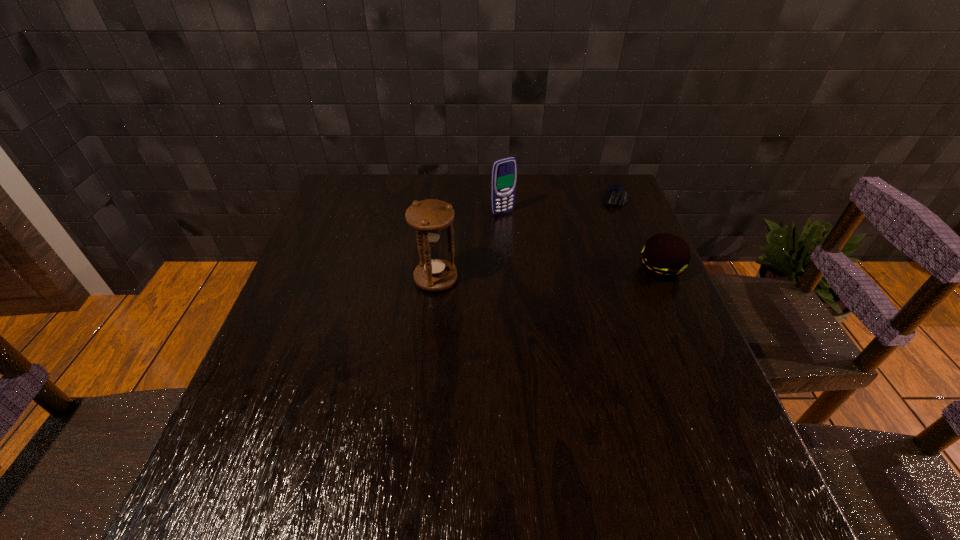
You are a GUI agent. You are given a task and a screenshot of the screen. Output one action in this format:
    pyautogui.click(x=<x>, y=<y>)
    Task: Click on the vacant space at the far edge
    This screenshot has width=960, height=540.
    Given the screenshot: What is the action you would take?
    pyautogui.click(x=398, y=212)

Locate an element on the screen. The image size is (960, 540). vacant region at the near edge of the desktop is located at coordinates (459, 429).

Locate an element on the screen. free spot at the left edge of the desktop is located at coordinates (277, 327).

The image size is (960, 540). I want to click on vacant area at the right edge, so click(616, 329).

The image size is (960, 540). In the image, there is a desktop. What are the coordinates of `free region at the far left corner` in the screenshot? It's located at (370, 194).

At what (x,y) coordinates should I click in order to perform the action: click on vacant space at the far right corner of the desktop. Please return your answer as a coordinate pair (x, y). The image size is (960, 540). Looking at the image, I should click on (638, 216).

This screenshot has width=960, height=540. I want to click on vacant region between the shortest object and the tallest object, so click(525, 239).

This screenshot has height=540, width=960. I want to click on free spot between the leftmost object and the second farthest object, so click(469, 246).

This screenshot has height=540, width=960. Identify the location of free space between the third tallest object and the computer mouse. (637, 234).

What are the coordinates of `vacant point located between the third nearest object and the computer mouse` in the screenshot? It's located at (559, 206).